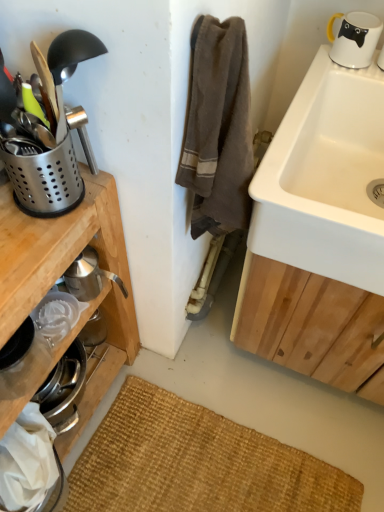
Find the location of a particular element. white ceramic sink at upper right is located at coordinates (325, 178).

At what (x,y) coordinates should I click in order to perform the action: click on white ceramic sink at upper right. Please return your answer as a coordinate pair (x, y). This screenshot has height=512, width=384. Looking at the image, I should click on (325, 178).

What's the angular difference between polished stainless steel utensil holder at left, the second appliance positioned from the front, and polished stainless steel utensil holder at left, which is the 2th appliance from back to front,'s facing directions?

The angle between the facing direction of polished stainless steel utensil holder at left, the second appliance positioned from the front, and the facing direction of polished stainless steel utensil holder at left, which is the 2th appliance from back to front, is 3.61 degrees.

Which of these two, polished stainless steel utensil holder at left, the second appliance positioned from the front, or polished stainless steel utensil holder at left, which is the 2th appliance from back to front, is smaller?

With smaller size is polished stainless steel utensil holder at left, the second appliance positioned from the front.

Is point (33, 205) closer or farther from the camera than point (91, 153)?

Point (33, 205) is closer to the camera than point (91, 153).

Measure the distance from polished stainless steel utensil holder at left, which is counted as the 1th appliance, starting from the back, to polished stainless steel utensil holder at left, positioned as the 1th appliance in front-to-back order.

1.31 inches.

Between white glossy mug at upper right and white ceramic sink at upper right, which one has larger size?

With larger size is white ceramic sink at upper right.

Is there a large distance between white glossy mug at upper right and white ceramic sink at upper right?

No, white glossy mug at upper right is not far away from white ceramic sink at upper right.

From the image's perspective, is white glossy mug at upper right on top of white ceramic sink at upper right?

Yes, from the image's perspective, white glossy mug at upper right is on top of white ceramic sink at upper right.

Looking at this image, from a real-world perspective, which object rests below the other?

white ceramic sink at upper right, from a real-world perspective.

In terms of size, does polished stainless steel utensil holder at left, which is the 2th appliance from back to front, appear bigger or smaller than white ceramic sink at upper right?

polished stainless steel utensil holder at left, which is the 2th appliance from back to front, is smaller than white ceramic sink at upper right.

Considering the sizes of objects polished stainless steel utensil holder at left, which is the 2th appliance from back to front, and white ceramic sink at upper right in the image provided, who is wider, polished stainless steel utensil holder at left, which is the 2th appliance from back to front, or white ceramic sink at upper right?

white ceramic sink at upper right.

Is polished stainless steel utensil holder at left, which is the 2th appliance from back to front, not within white ceramic sink at upper right?

Yes, polished stainless steel utensil holder at left, which is the 2th appliance from back to front, is outside of white ceramic sink at upper right.

Considering the relative sizes of polished stainless steel utensil holder at left, which is counted as the 1th appliance, starting from the back, and white glossy mug at upper right in the image provided, is polished stainless steel utensil holder at left, which is counted as the 1th appliance, starting from the back, shorter than white glossy mug at upper right?

Incorrect, the height of polished stainless steel utensil holder at left, which is counted as the 1th appliance, starting from the back, does not fall short of that of white glossy mug at upper right.

Considering the relative sizes of polished stainless steel utensil holder at left, the second appliance positioned from the front, and white glossy mug at upper right in the image provided, is polished stainless steel utensil holder at left, the second appliance positioned from the front, thinner than white glossy mug at upper right?

In fact, polished stainless steel utensil holder at left, the second appliance positioned from the front, might be wider than white glossy mug at upper right.

Is point (46, 208) behind point (368, 56)?

No, it is in front of (368, 56).

Could you measure the distance between polished stainless steel utensil holder at left, which is counted as the 1th appliance, starting from the back, and white glossy mug at upper right?

A distance of 29.82 inches exists between polished stainless steel utensil holder at left, which is counted as the 1th appliance, starting from the back, and white glossy mug at upper right.

Choose the correct answer: Is white glossy mug at upper right inside polished stainless steel utensil holder at left, the second appliance positioned from the front, or outside it?

The correct answer is: outside.

Visually, is white glossy mug at upper right positioned to the left or to the right of polished stainless steel utensil holder at left, which is counted as the 1th appliance, starting from the back?

white glossy mug at upper right is positioned on polished stainless steel utensil holder at left, which is counted as the 1th appliance, starting from the back,'s right side.

Is white glossy mug at upper right oriented towards polished stainless steel utensil holder at left, which is counted as the 1th appliance, starting from the back?

No, white glossy mug at upper right is not oriented towards polished stainless steel utensil holder at left, which is counted as the 1th appliance, starting from the back.

Is white glossy mug at upper right not close to polished stainless steel utensil holder at left, the second appliance positioned from the front?

No, white glossy mug at upper right is not far away from polished stainless steel utensil holder at left, the second appliance positioned from the front.

Is polished stainless steel utensil holder at left, which is the 2th appliance from back to front, turned away from polished stainless steel utensil holder at left, which is counted as the 1th appliance, starting from the back?

Yes.

Considering the relative positions of polished stainless steel utensil holder at left, which is the 2th appliance from back to front, and polished stainless steel utensil holder at left, which is counted as the 1th appliance, starting from the back, in the image provided, is polished stainless steel utensil holder at left, which is the 2th appliance from back to front, behind polished stainless steel utensil holder at left, which is counted as the 1th appliance, starting from the back,?

No.

In terms of width, does polished stainless steel utensil holder at left, which is the 2th appliance from back to front, look wider or thinner when compared to polished stainless steel utensil holder at left, the second appliance positioned from the front?

Clearly, polished stainless steel utensil holder at left, which is the 2th appliance from back to front, has more width compared to polished stainless steel utensil holder at left, the second appliance positioned from the front.

Are polished stainless steel utensil holder at left, which is the 2th appliance from back to front, and polished stainless steel utensil holder at left, which is counted as the 1th appliance, starting from the back, making contact?

Yes, polished stainless steel utensil holder at left, which is the 2th appliance from back to front, is touching polished stainless steel utensil holder at left, which is counted as the 1th appliance, starting from the back.

The width and height of the screenshot is (384, 512). In the image, there is a polished stainless steel utensil holder at left, the second appliance positioned from the front. Identify the location of sink below it (from a real-world perspective). (325, 178).

Is white ceramic sink at upper right taller or shorter than polished stainless steel utensil holder at left, the second appliance positioned from the front?

In the image, white ceramic sink at upper right appears to be taller than polished stainless steel utensil holder at left, the second appliance positioned from the front.

Is polished stainless steel utensil holder at left, which is counted as the 1th appliance, starting from the back, inside white ceramic sink at upper right?

No, polished stainless steel utensil holder at left, which is counted as the 1th appliance, starting from the back, is not inside white ceramic sink at upper right.

The image size is (384, 512). What are the coordinates of `appliance above the polished stainless steel utensil holder at left, the second appliance positioned from the front (from a real-world perspective)` in the screenshot? It's located at (48, 135).

This screenshot has height=512, width=384. Identify the location of sink in front of the white glossy mug at upper right. (325, 178).

Estimate the real-world distances between objects in this image. Which object is further from white ceramic sink at upper right, polished stainless steel utensil holder at left, the second appliance positioned from the front, or white glossy mug at upper right?

polished stainless steel utensil holder at left, the second appliance positioned from the front.

Looking at the image, which one is located further to white glossy mug at upper right, polished stainless steel utensil holder at left, which is the 2th appliance from back to front, or polished stainless steel utensil holder at left, the second appliance positioned from the front?

polished stainless steel utensil holder at left, the second appliance positioned from the front.

Which object lies further to the anchor point polished stainless steel utensil holder at left, positioned as the 1th appliance in front-to-back order, white glossy mug at upper right or white ceramic sink at upper right?

Based on the image, white glossy mug at upper right appears to be further to polished stainless steel utensil holder at left, positioned as the 1th appliance in front-to-back order.

Looking at the image, which one is located further to polished stainless steel utensil holder at left, which is the 2th appliance from back to front, white ceramic sink at upper right or polished stainless steel utensil holder at left, the second appliance positioned from the front?

Based on the image, white ceramic sink at upper right appears to be further to polished stainless steel utensil holder at left, which is the 2th appliance from back to front.

Based on their spatial positions, is polished stainless steel utensil holder at left, the second appliance positioned from the front, or white glossy mug at upper right further from polished stainless steel utensil holder at left, which is the 2th appliance from back to front?

white glossy mug at upper right is further to polished stainless steel utensil holder at left, which is the 2th appliance from back to front.

When comparing their distances from white glossy mug at upper right, does polished stainless steel utensil holder at left, which is counted as the 1th appliance, starting from the back, or white ceramic sink at upper right seem closer?

white ceramic sink at upper right is positioned closer to the anchor white glossy mug at upper right.

Estimate the real-world distances between objects in this image. Which object is closer to white glossy mug at upper right, polished stainless steel utensil holder at left, which is the 2th appliance from back to front, or white ceramic sink at upper right?

white ceramic sink at upper right is positioned closer to the anchor white glossy mug at upper right.

Looking at the image, which one is located further to white glossy mug at upper right, white ceramic sink at upper right or polished stainless steel utensil holder at left, positioned as the 1th appliance in front-to-back order?

Based on the image, polished stainless steel utensil holder at left, positioned as the 1th appliance in front-to-back order, appears to be further to white glossy mug at upper right.

Where is `appliance between polished stainless steel utensil holder at left, the second appliance positioned from the front, and white ceramic sink at upper right from left to right`? The height and width of the screenshot is (512, 384). appliance between polished stainless steel utensil holder at left, the second appliance positioned from the front, and white ceramic sink at upper right from left to right is located at coordinates (48, 135).

Identify the location of appliance between polished stainless steel utensil holder at left, the second appliance positioned from the front, and white glossy mug at upper right from left to right. This screenshot has width=384, height=512. (48, 135).

Find the location of `sink between polished stainless steel utensil holder at left, positioned as the 1th appliance in front-to-back order, and white glossy mug at upper right, in the horizontal direction`. sink between polished stainless steel utensil holder at left, positioned as the 1th appliance in front-to-back order, and white glossy mug at upper right, in the horizontal direction is located at coordinates (325, 178).

The image size is (384, 512). Identify the location of sink situated between polished stainless steel utensil holder at left, which is counted as the 1th appliance, starting from the back, and white glossy mug at upper right from left to right. (325, 178).